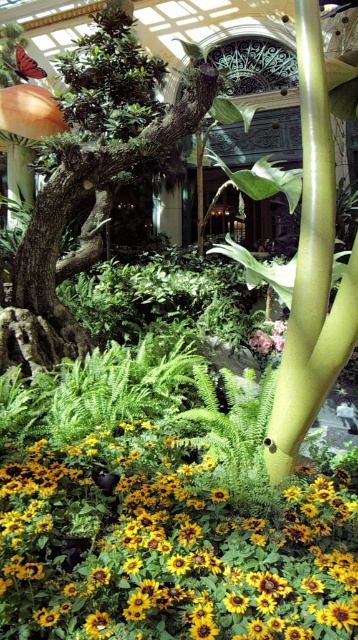
You are a florist arranging a bouquet and need to know the relative sizes of the flowers in the image. Based on the scene, can you determine which flower, the yellow matte flower at center or the pink matte flower at center, is wider?

The yellow matte flower at center is wider than the pink matte flower at center according to the description.

You are standing in the indoor garden and want to take a photo of both the sunflowers and the green monstera plant. You notice two points marked in the scene. The first point is at coordinate point(93, 509) and the second is at point(276, 333). Which point should you stand closer to in order to have both the sunflowers and the monstera plant visible in your camera frame?

You should stand closer to point(93, 509) because it is in front of point(276, 333), allowing you to capture both the sunflowers and the monstera plant in your camera frame.